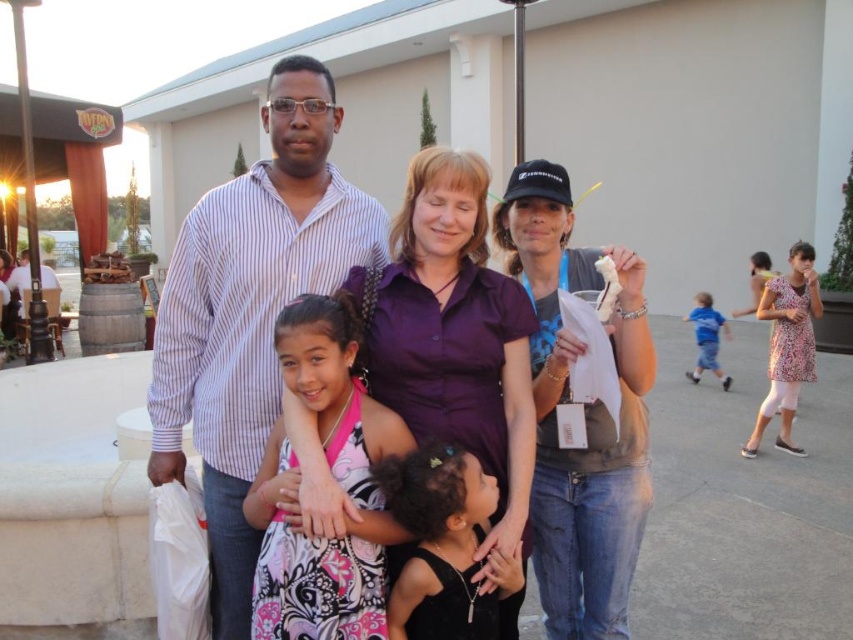
Does matte black shirt at center appear on the left side of blue denim shorts at right?

Yes, matte black shirt at center is to the left of blue denim shorts at right.

Is matte black shirt at center thinner than blue denim shorts at right?

Indeed, matte black shirt at center has a lesser width compared to blue denim shorts at right.

Who is more distant from viewer, (550,576) or (717,330)?

Point (717,330)

Identify the location of matte black shirt at center. (583, 413).

Can you confirm if black satin dress at center is positioned below blue denim shorts at right?

Indeed, black satin dress at center is positioned under blue denim shorts at right.

Consider the image. Who is lower down, black satin dress at center or blue denim shorts at right?

black satin dress at center is lower down.

What do you see at coordinates (444, 545) in the screenshot? I see `black satin dress at center` at bounding box center [444, 545].

Find the location of a particular element. The height and width of the screenshot is (640, 853). black satin dress at center is located at coordinates (444, 545).

Who is taller, matte black shirt at center or black satin dress at center?

matte black shirt at center is taller.

Between point (552, 314) and point (474, 612), which one is positioned behind?

The point (552, 314) is behind.

Between point (531, 179) and point (502, 568), which one is positioned behind?

Positioned behind is point (531, 179).

Where is `matte black shirt at center`? This screenshot has height=640, width=853. matte black shirt at center is located at coordinates (583, 413).